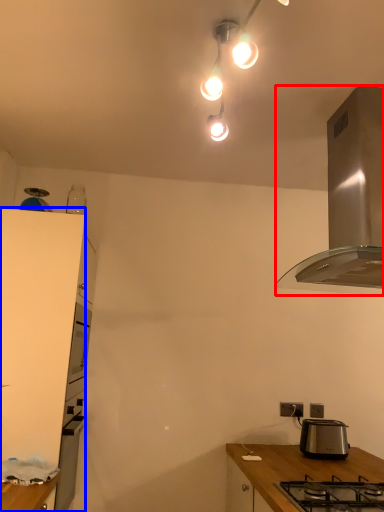
Question: Which point is closer to the camera, kitchen appliance (highlighted by a red box) or cabinetry (highlighted by a blue box)?

Choices:
 (A) kitchen appliance
 (B) cabinetry

Answer: (A)